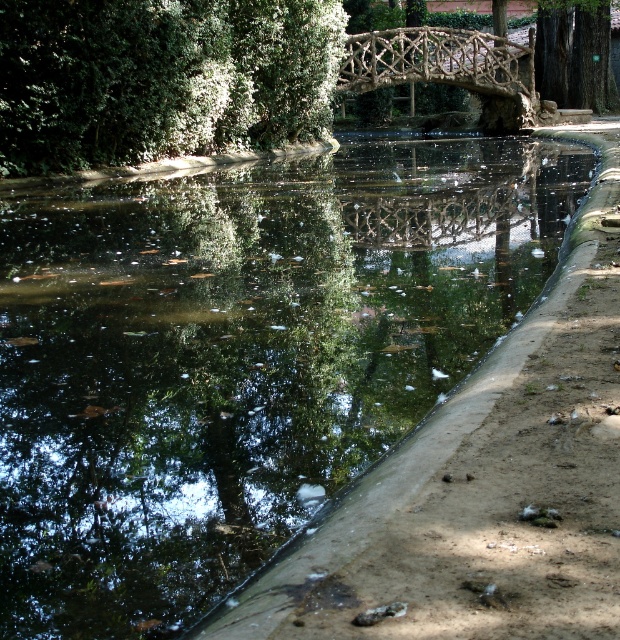
Measure the distance from natural wood bridge at center to green rough bark tree at upper right.

natural wood bridge at center is 20.39 feet from green rough bark tree at upper right.

Can you confirm if natural wood bridge at center is smaller than green rough bark tree at upper right?

Correct, natural wood bridge at center occupies less space than green rough bark tree at upper right.

The image size is (620, 640). Describe the element at coordinates (446, 67) in the screenshot. I see `natural wood bridge at center` at that location.

Where is `natural wood bridge at center`? The image size is (620, 640). natural wood bridge at center is located at coordinates (446, 67).

Is green leafy tree at upper left to the right of natural wood bridge at center from the viewer's perspective?

No, green leafy tree at upper left is not to the right of natural wood bridge at center.

Is point (299, 45) more distant than point (438, 76)?

No, it is not.

You are a GUI agent. You are given a task and a screenshot of the screen. Output one action in this format:
    pyautogui.click(x=<x>, y=<y>)
    Task: Click on the green leafy tree at upper left
    The height and width of the screenshot is (640, 620).
    Given the screenshot: What is the action you would take?
    pyautogui.click(x=161, y=77)

Between green leafy tree at upper left and green rough bark tree at upper right, which one appears on the right side from the viewer's perspective?

green rough bark tree at upper right is more to the right.

Between green leafy tree at upper left and green rough bark tree at upper right, which one has less height?

green leafy tree at upper left

You are a GUI agent. You are given a task and a screenshot of the screen. Output one action in this format:
    pyautogui.click(x=<x>, y=<y>)
    Task: Click on the green leafy tree at upper left
    
    Given the screenshot: What is the action you would take?
    pyautogui.click(x=161, y=77)

You are a GUI agent. You are given a task and a screenshot of the screen. Output one action in this format:
    pyautogui.click(x=<x>, y=<y>)
    Task: Click on the green leafy tree at upper left
    The width and height of the screenshot is (620, 640).
    Given the screenshot: What is the action you would take?
    [161, 77]